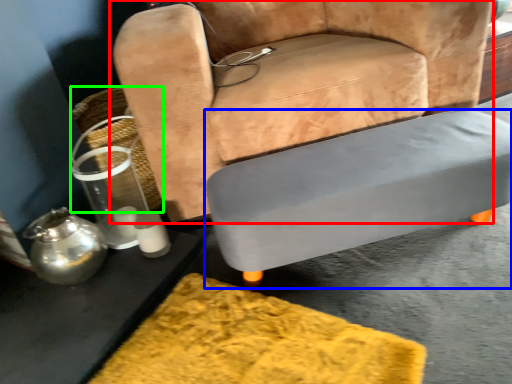
Question: Estimate the real-world distances between objects in this image. Which object is farther from chair (highlighted by a red box), table (highlighted by a blue box) or basket (highlighted by a green box)?

Choices:
 (A) table
 (B) basket

Answer: (B)